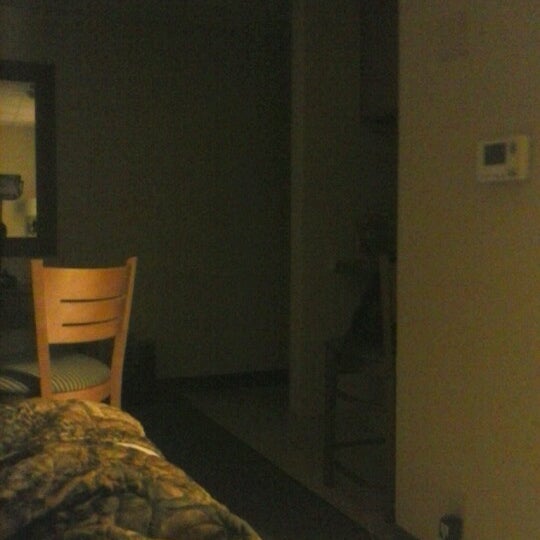
At what (x,y) coordinates should I click in order to perform the action: click on chair slats or openings. Please return your answer as a coordinate pair (x, y). This screenshot has height=540, width=540. Looking at the image, I should click on (104, 299), (103, 322), (101, 367).